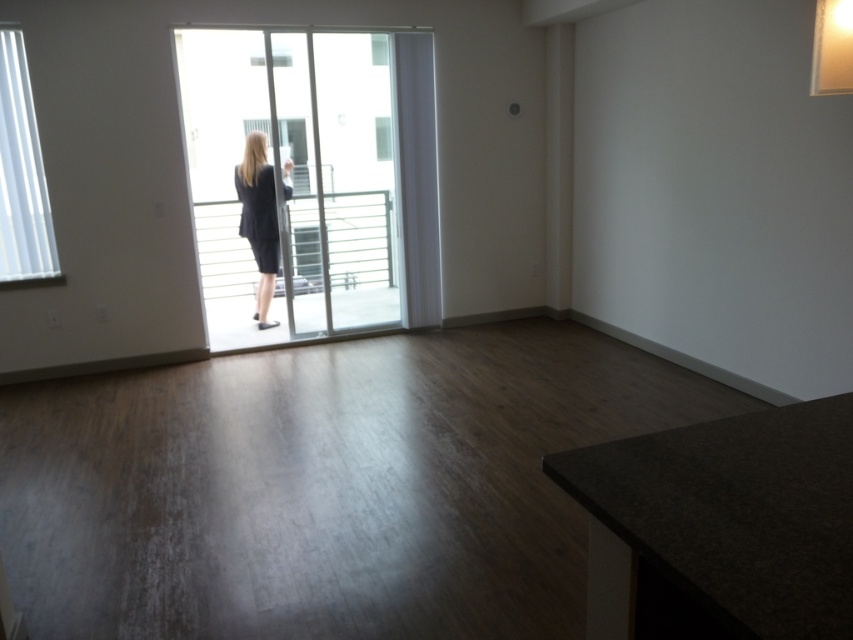
Is white frosted glass window at upper left smaller than matte black suit at center?

Yes.

Does white frosted glass window at upper left have a greater height compared to matte black suit at center?

No, white frosted glass window at upper left is not taller than matte black suit at center.

Is point (44, 276) farther from camera compared to point (238, 234)?

No.

Locate an element on the screen. The height and width of the screenshot is (640, 853). white frosted glass window at upper left is located at coordinates (21, 173).

Is point (323, 227) less distant than point (3, 157)?

No.

Locate an element on the screen. clear glass sliding door at center is located at coordinates click(316, 177).

Between clear glass sliding door at center and matte black suit at center, which one appears on the left side from the viewer's perspective?

From the viewer's perspective, clear glass sliding door at center appears more on the left side.

Based on the photo, does clear glass sliding door at center have a smaller size compared to matte black suit at center?

No.

Describe the element at coordinates (316, 177) in the screenshot. I see `clear glass sliding door at center` at that location.

Find the location of a particular element. Image resolution: width=853 pixels, height=640 pixels. clear glass sliding door at center is located at coordinates (316, 177).